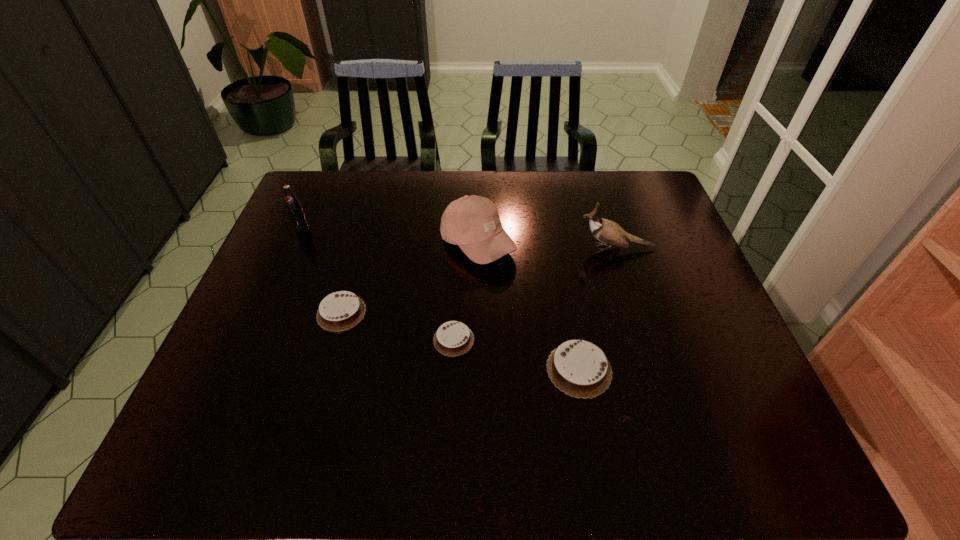
You are a GUI agent. You are given a task and a screenshot of the screen. Output one action in this format:
    pyautogui.click(x=<x>, y=<y>)
    Task: Click on the vacant area that lies between the second chocolate cake from right to left and the bird
    The height and width of the screenshot is (540, 960).
    Given the screenshot: What is the action you would take?
    pyautogui.click(x=535, y=294)

Locate an element on the screen. This screenshot has height=540, width=960. free space between the second chocolate cake from left to right and the fourth tallest object is located at coordinates (516, 354).

This screenshot has height=540, width=960. Identify the location of free space between the pop and the baseball cap. (390, 236).

Where is `free space between the bird and the leftmost chocolate cake`? This screenshot has width=960, height=540. free space between the bird and the leftmost chocolate cake is located at coordinates (479, 280).

Identify the location of empty space that is in between the baseball cap and the pop. Image resolution: width=960 pixels, height=540 pixels. (390, 236).

Locate which object is the closest to the shortest object. Please provide its 2D coordinates. Your answer should be formatted as a tuple, i.e. [(x, y)], where the tuple contains the x and y coordinates of a point satisfying the conditions above.

[(579, 368)]

Choose which object is the fifth nearest neighbor to the shortest object. Please provide its 2D coordinates. Your answer should be formatted as a tuple, i.e. [(x, y)], where the tuple contains the x and y coordinates of a point satisfying the conditions above.

[(295, 211)]

Locate an element on the screen. The height and width of the screenshot is (540, 960). the closest chocolate cake to the tallest chocolate cake is located at coordinates (453, 338).

Select which chocolate cake is the third closest to the leftmost object. Please provide its 2D coordinates. Your answer should be formatted as a tuple, i.e. [(x, y)], where the tuple contains the x and y coordinates of a point satisfying the conditions above.

[(579, 368)]

Identify the location of vacant space that satisfies the following two spatial constraints: 1. on the front-facing side of the third shortest object; 2. on the right side of the baseball cap. (477, 369).